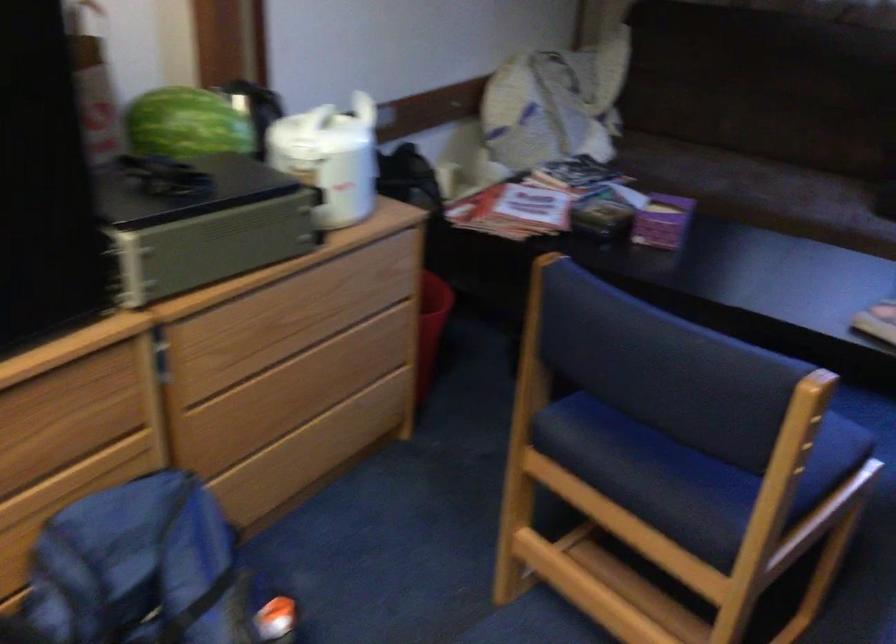
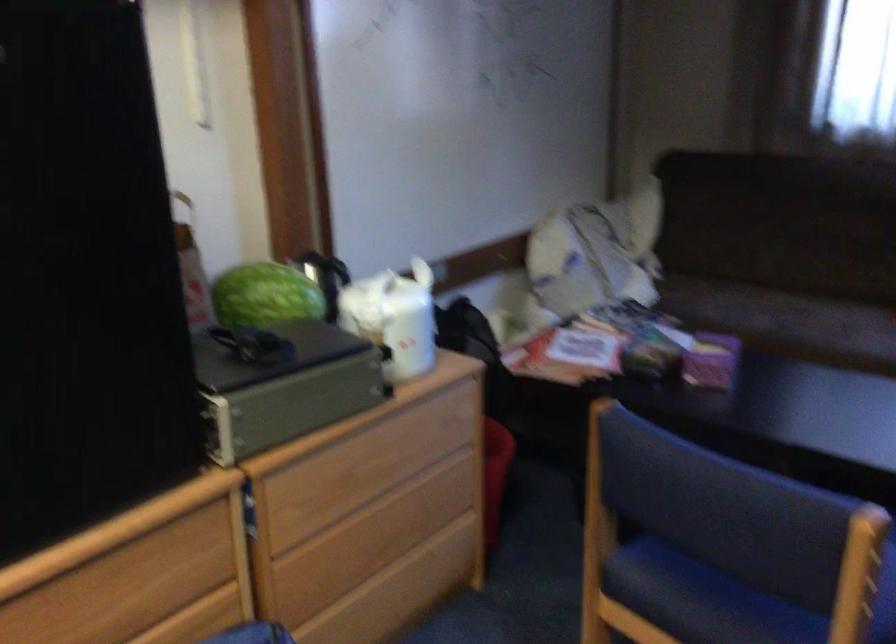
Where in the second image is the point corresponding to the point at 131,268 from the first image?

(222, 433)